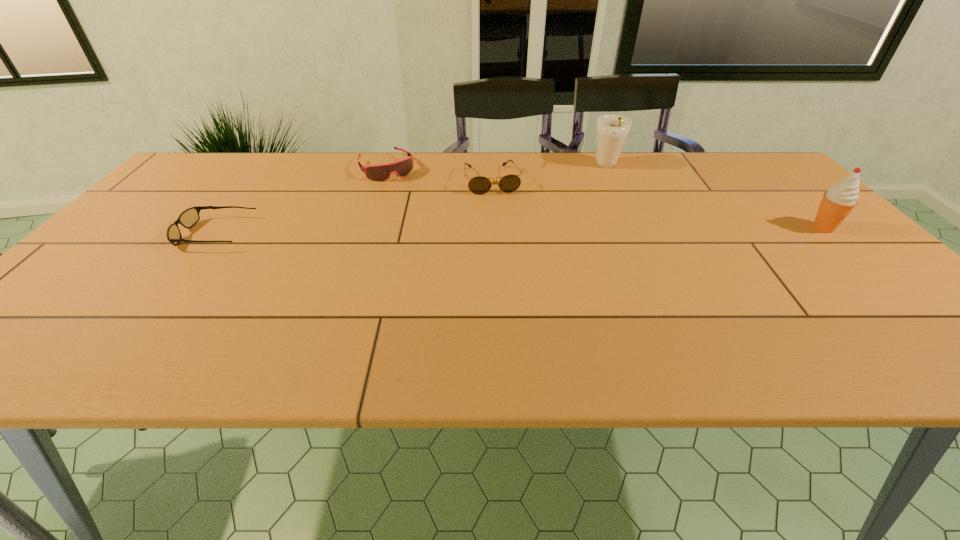
Where is `root beer that is positioned at the far edge`? This screenshot has height=540, width=960. root beer that is positioned at the far edge is located at coordinates (611, 132).

Find the location of `goggles located at the far edge`. goggles located at the far edge is located at coordinates (381, 172).

I want to click on object located at the left edge, so click(188, 218).

Find the location of `object present at the right edge`. object present at the right edge is located at coordinates (838, 202).

Where is `vacant space at the far edge of the desktop`? The image size is (960, 540). vacant space at the far edge of the desktop is located at coordinates (654, 162).

This screenshot has height=540, width=960. In the image, there is a desktop. Identify the location of vacant space at the near edge. (478, 325).

You are a GUI agent. You are given a task and a screenshot of the screen. Output one action in this format:
    pyautogui.click(x=<x>, y=<y>)
    Task: Click on the vacant area at the right edge of the desktop
    This screenshot has width=960, height=540.
    Given the screenshot: What is the action you would take?
    pyautogui.click(x=842, y=251)

Image resolution: width=960 pixels, height=540 pixels. In order to click on vacant space at the far left corner of the desktop in this screenshot , I will do `click(221, 181)`.

At what (x,y) coordinates should I click in order to perform the action: click on vacant region at the far right corner of the desktop. Please return your answer as a coordinate pair (x, y). Looking at the image, I should click on (754, 158).

Image resolution: width=960 pixels, height=540 pixels. I want to click on free spot between the third object from left to right and the goggles, so click(x=440, y=174).